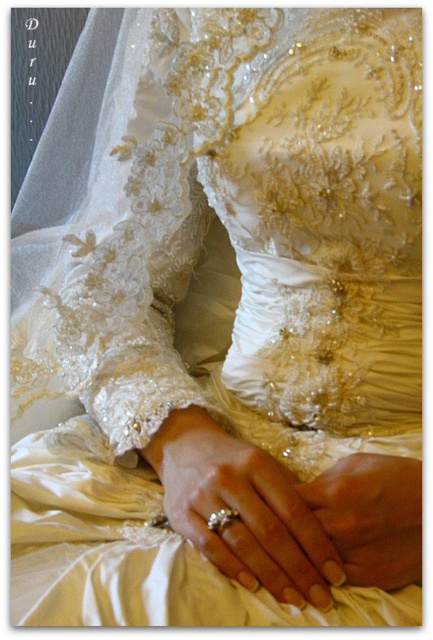
Question: Among these objects, which one is farthest from the camera?

Choices:
 (A) smooth beige hand at center
 (B) gold shiny ring at center

Answer: (B)

Question: Is smooth beige hand at center to the right of gold shiny ring at center from the viewer's perspective?

Choices:
 (A) yes
 (B) no

Answer: (A)

Question: Which point is closer to the camera?

Choices:
 (A) gold shiny ring at center
 (B) silver metallic ring at center

Answer: (B)

Question: Where is silver metallic ring at center located in relation to gold shiny ring at center in the image?

Choices:
 (A) right
 (B) left

Answer: (A)

Question: Is silver metallic ring at center below smooth beige hand at center?

Choices:
 (A) no
 (B) yes

Answer: (A)

Question: Which object is positioned closest to the smooth beige hand at center?

Choices:
 (A) gold shiny ring at center
 (B) silver metallic ring at center

Answer: (B)